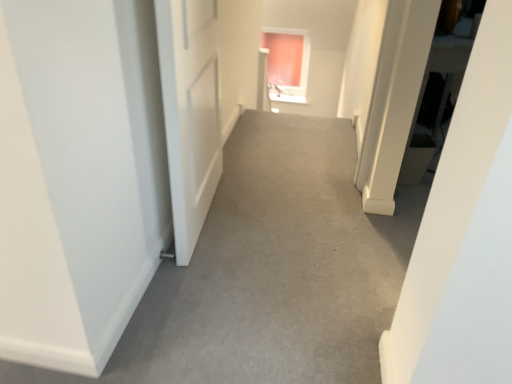
Question: From the image's perspective, is pink glass window at upper center below gray carpet at center?

Choices:
 (A) yes
 (B) no

Answer: (B)

Question: Is pink glass window at upper center in front of gray carpet at center?

Choices:
 (A) no
 (B) yes

Answer: (A)

Question: Considering the relative sizes of pink glass window at upper center and gray carpet at center in the image provided, is pink glass window at upper center thinner than gray carpet at center?

Choices:
 (A) no
 (B) yes

Answer: (B)

Question: Is pink glass window at upper center touching gray carpet at center?

Choices:
 (A) yes
 (B) no

Answer: (B)

Question: Is pink glass window at upper center not close to gray carpet at center?

Choices:
 (A) yes
 (B) no

Answer: (A)

Question: Considering the relative positions of pink glass window at upper center and gray carpet at center in the image provided, is pink glass window at upper center to the left of gray carpet at center from the viewer's perspective?

Choices:
 (A) no
 (B) yes

Answer: (A)

Question: From the image's perspective, would you say gray carpet at center is positioned over pink glass window at upper center?

Choices:
 (A) no
 (B) yes

Answer: (A)

Question: Is gray carpet at center further to the viewer compared to pink glass window at upper center?

Choices:
 (A) yes
 (B) no

Answer: (B)

Question: From a real-world perspective, is gray carpet at center physically below pink glass window at upper center?

Choices:
 (A) yes
 (B) no

Answer: (B)

Question: Considering the relative sizes of gray carpet at center and pink glass window at upper center in the image provided, is gray carpet at center thinner than pink glass window at upper center?

Choices:
 (A) no
 (B) yes

Answer: (A)

Question: Is gray carpet at center bigger than pink glass window at upper center?

Choices:
 (A) no
 (B) yes

Answer: (B)

Question: Is gray carpet at center to the left of pink glass window at upper center from the viewer's perspective?

Choices:
 (A) yes
 (B) no

Answer: (A)

Question: Does point (289, 77) appear closer or farther from the camera than point (284, 241)?

Choices:
 (A) closer
 (B) farther

Answer: (B)